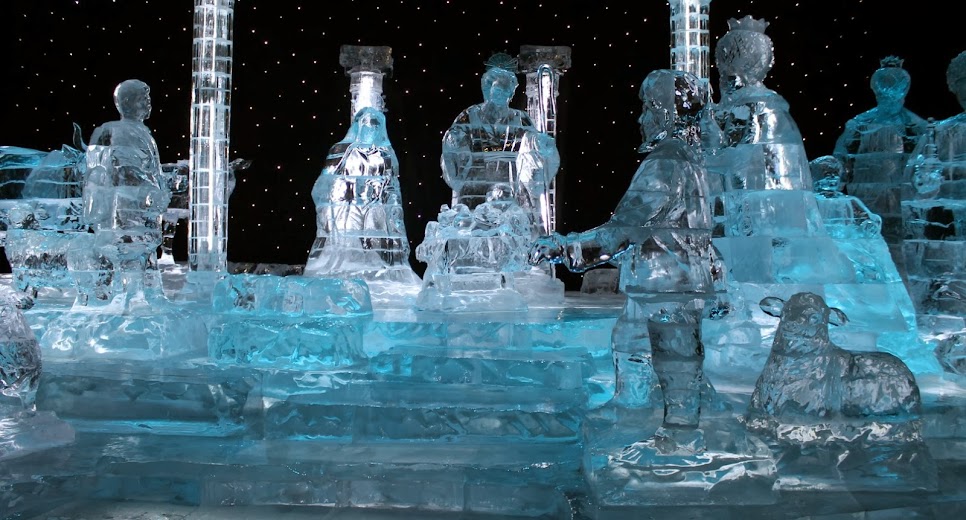
At what (x,y) coordinates should I click in order to perform the action: click on clear rounded columns. Please return your answer as a coordinate pair (x, y). Image resolution: width=966 pixels, height=520 pixels. Looking at the image, I should click on (223, 67), (355, 83), (535, 79), (701, 33).